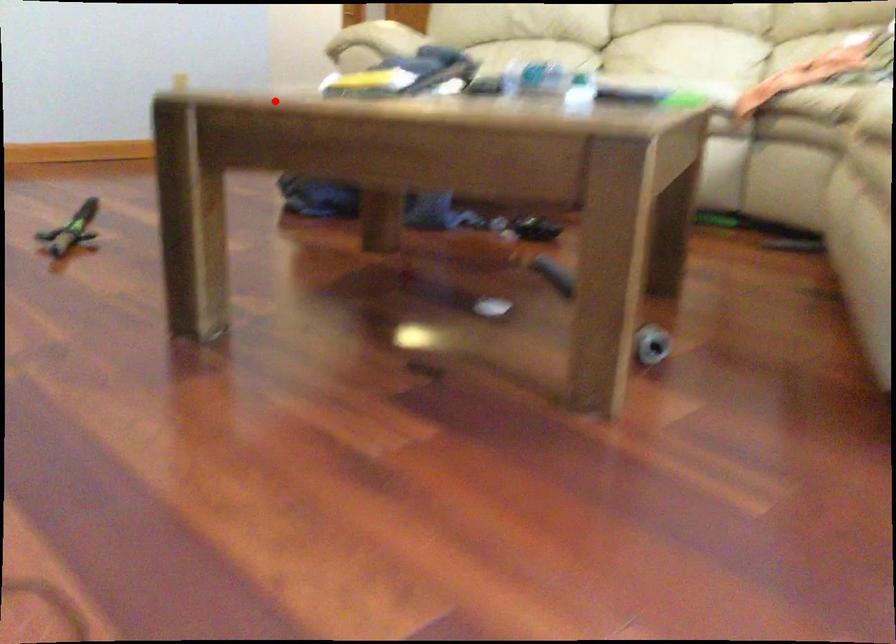
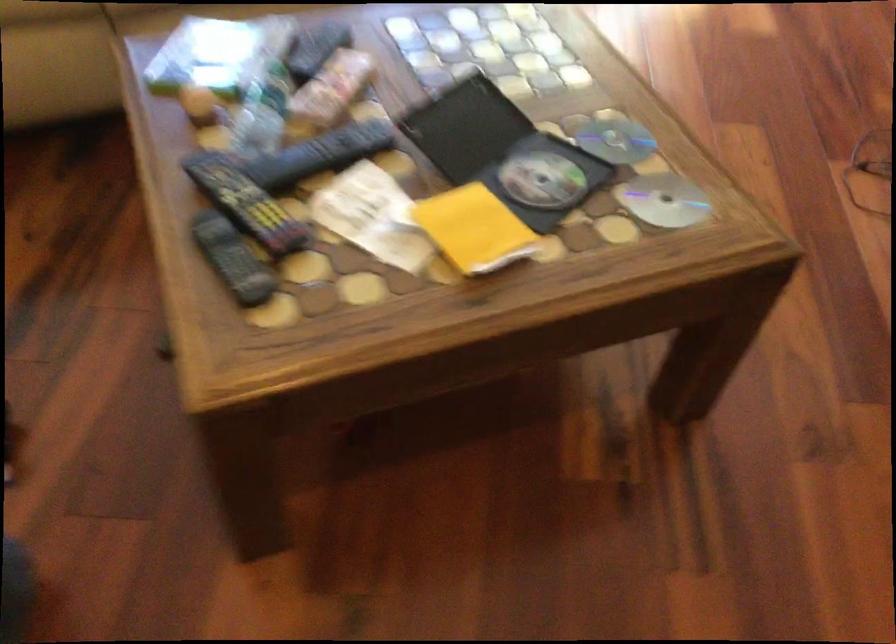
In the second image, find the point that corresponds to the highlighted location in the first image.

(664, 200)